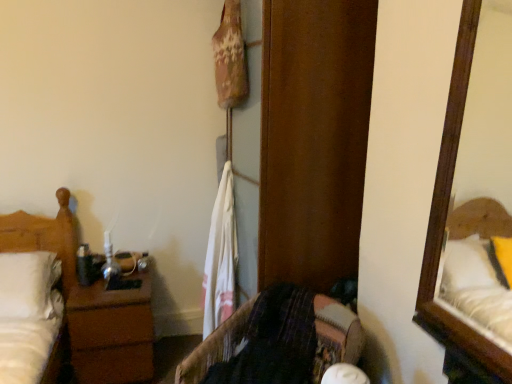
I want to click on vacant space situated above brown wood nightstand at left (from a real-world perspective), so click(117, 279).